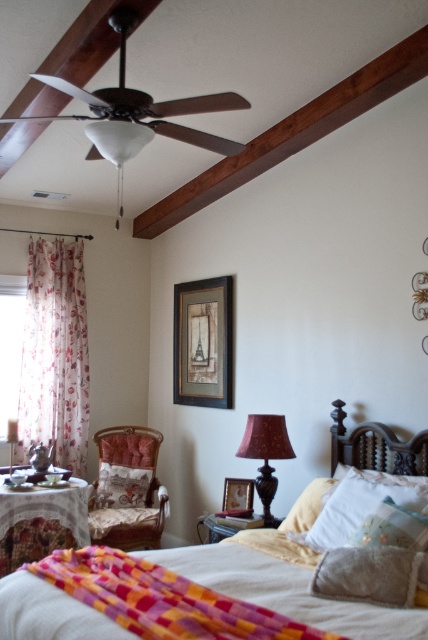
You are standing in the bedroom and want to place a small decorative item on the bed. The bed has two spots marked as point A at coordinates point (127,131) and point B at coordinates point (103,476). Which point is closer to you, point A or point B?

Point A at coordinates point (127,131) is closer to you than point B at coordinates point (103,476).

You are arranging a nightstand next to the bed and want to place both the white matte lampshade at center and the velvet cushion at center on it. However, the nightstand has limited space. Based on their positions in the image, which item should you place first to ensure both fit?

The white matte lampshade at center is positioned over the velvet cushion at center, meaning the velvet cushion at center is underneath. To fit both on the nightstand, place the velvet cushion at center first, then the white matte lampshade at center on top of it.